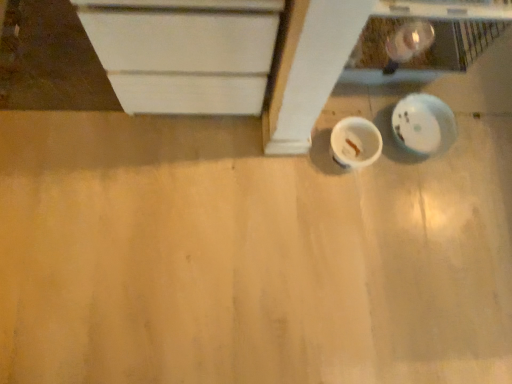
Find the location of a particular element. This screenshot has width=512, height=384. free space in front of white matte cabinet at upper left is located at coordinates (161, 174).